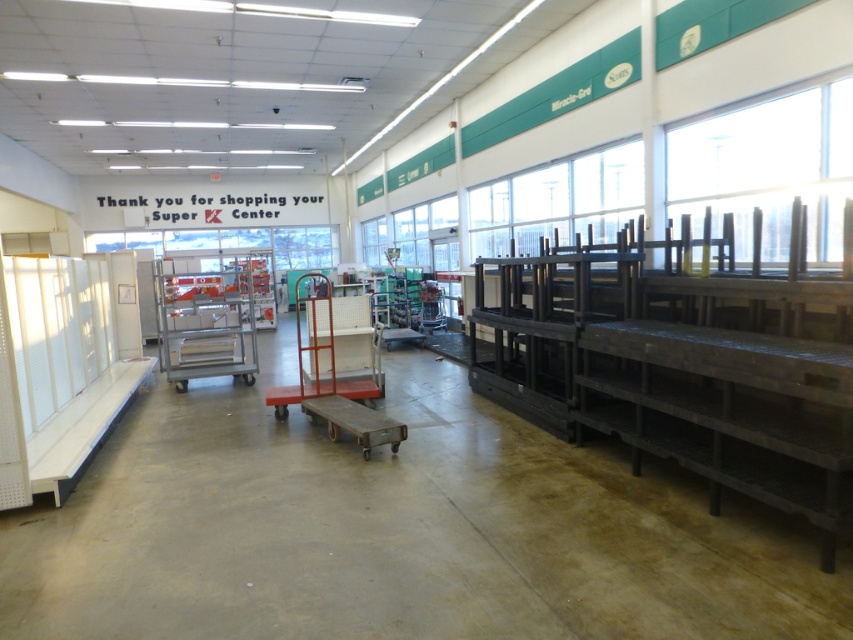
You are a store employee who needs to move a large box from the entrance to the back storage area. You have access to both the metallic gray cart at center and the white plastic cart at center. Which cart should you choose if you want to ensure the box fits on the cart without overhanging?

The metallic gray cart at center is wider than the white plastic cart at center, so you should choose the metallic gray cart at center to ensure the box fits without overhanging.

You are a store employee who needs to move the white plastic cart at center to the empty shelves on the right. Can you move it around the metallic gray cart at center without moving the metallic gray cart?

The white plastic cart at center is behind the metallic gray cart at center, so you can move it around the metallic gray cart at center by going around its sides or back since it is not blocking the path completely.